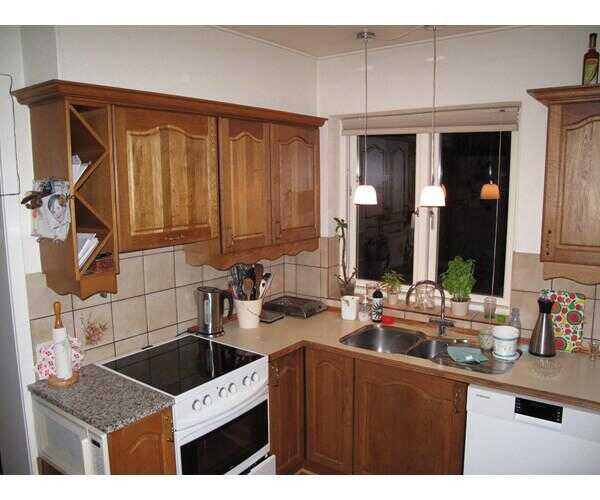
Find the location of a particular element. The image size is (600, 500). cream colored ceiling, background is located at coordinates (303, 31).